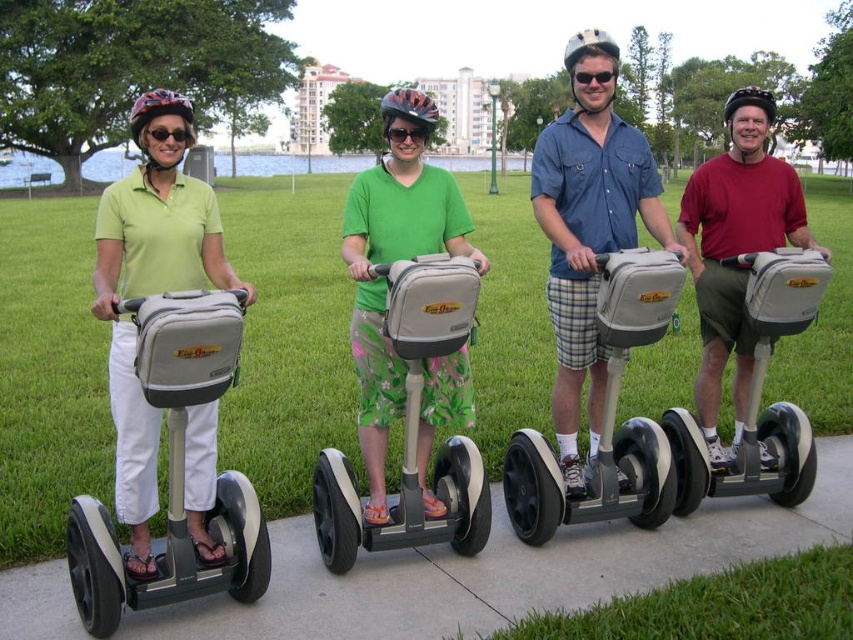
Is gray matte segway at center shorter than matte gray scooter at right?

No.

Who is lower down, gray matte segway at center or matte gray scooter at right?

gray matte segway at center is below.

What do you see at coordinates (605, 417) in the screenshot? The image size is (853, 640). I see `gray matte segway at center` at bounding box center [605, 417].

Find the location of a particular element. gray matte segway at center is located at coordinates (605, 417).

Who is higher up, green matte shirt at center or matte gray scooter at center?

green matte shirt at center is higher up.

Can you confirm if green matte shirt at center is positioned to the left of matte gray scooter at center?

Yes, green matte shirt at center is to the left of matte gray scooter at center.

Find the location of a particular element. This screenshot has width=853, height=640. green matte shirt at center is located at coordinates (392, 260).

Who is taller, matte gray scooter at center or black matte sunglasses at center?

Standing taller between the two is matte gray scooter at center.

Is matte gray scooter at center taller than black matte sunglasses at center?

Yes, matte gray scooter at center is taller than black matte sunglasses at center.

Describe the element at coordinates (412, 424) in the screenshot. I see `matte gray scooter at center` at that location.

Locate an element on the screen. matte gray scooter at center is located at coordinates (412, 424).